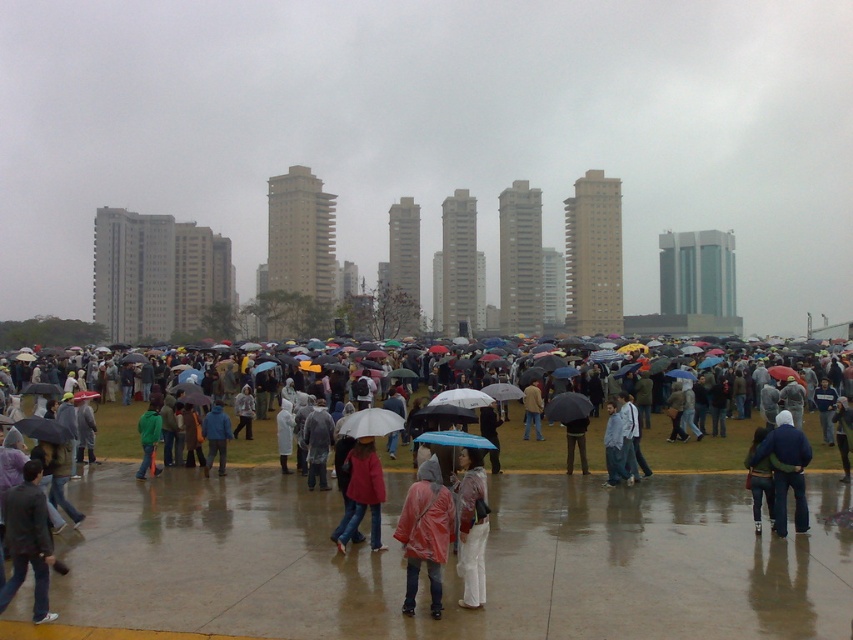
Which is more to the right, raincoats at center or dark gray jacket at lower left?

Positioned to the right is raincoats at center.

Does raincoats at center have a greater height compared to dark gray jacket at lower left?

Incorrect, raincoats at center's height is not larger of dark gray jacket at lower left's.

Does point (747, 618) come in front of point (3, 500)?

Yes, it is.

Locate an element on the screen. This screenshot has width=853, height=640. raincoats at center is located at coordinates (454, 561).

Between rubberized red raincoat at center and blue denim jacket at lower right, which one appears on the left side from the viewer's perspective?

Positioned to the left is rubberized red raincoat at center.

Is rubberized red raincoat at center shorter than blue denim jacket at lower right?

Indeed, rubberized red raincoat at center has a lesser height compared to blue denim jacket at lower right.

Is point (437, 465) positioned before point (778, 506)?

Yes.

The width and height of the screenshot is (853, 640). What are the coordinates of `rubberized red raincoat at center` in the screenshot? It's located at (425, 532).

Looking at this image, is rubberized red raincoat at center positioned at the back of raincoatwaterproofperson at center?

No.

Find the location of a particular element. rubberized red raincoat at center is located at coordinates (425, 532).

Between point (424, 477) and point (469, 532), which one is positioned in front?

Point (469, 532)

Where is `rubberized red raincoat at center`? The image size is (853, 640). rubberized red raincoat at center is located at coordinates (425, 532).